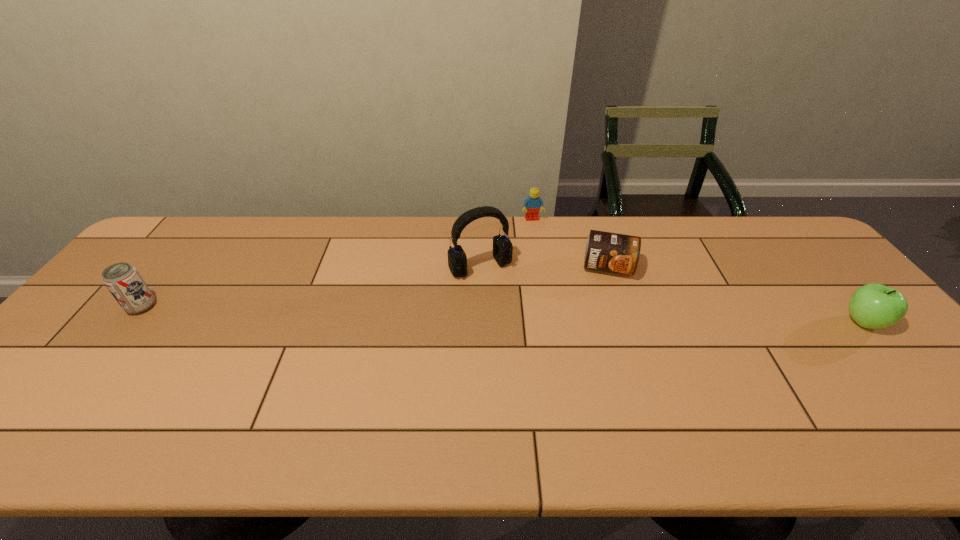
What are the coordinates of `vacant spot on the desktop that is between the beer can and the apple and is positioned on the face of the farthest object` in the screenshot? It's located at (560, 315).

The width and height of the screenshot is (960, 540). In order to click on vacant space on the desktop that is between the beer can and the rightmost object and is positioned on the headband of the tallest object in this screenshot , I will do `click(510, 314)`.

What are the coordinates of `vacant space on the desktop that is between the beer can and the rightmost object and is positioned on the front label of the can` in the screenshot? It's located at (605, 316).